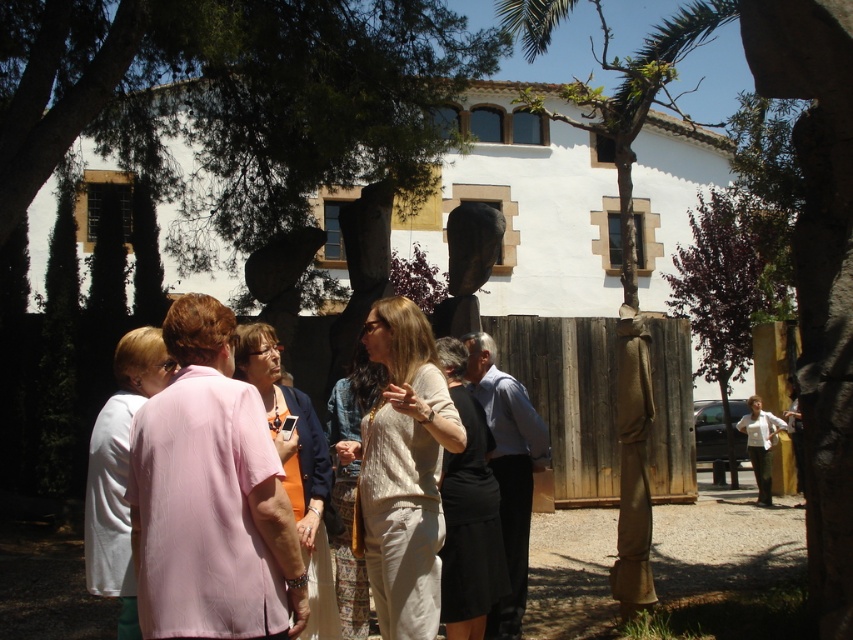
You are standing at the point with coordinates point (469, 330) and want to walk towards the point with coordinates point (601, 128). Will you be moving forward or backward relative to your current position?

Since point (601, 128) is behind point (469, 330), you will be moving backward relative to your current position at point (469, 330).

You are part of the group standing near the brown wooden tree at center and the black stone sculpture at center. If you want to touch both objects, which one would you reach first?

You would reach the brown wooden tree at center first because it is closer to you than the black stone sculpture at center.